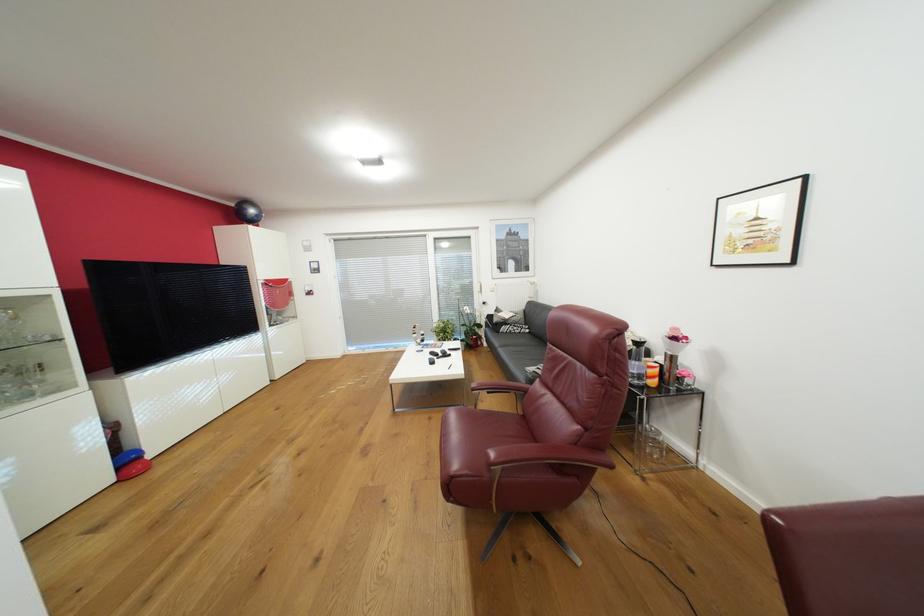
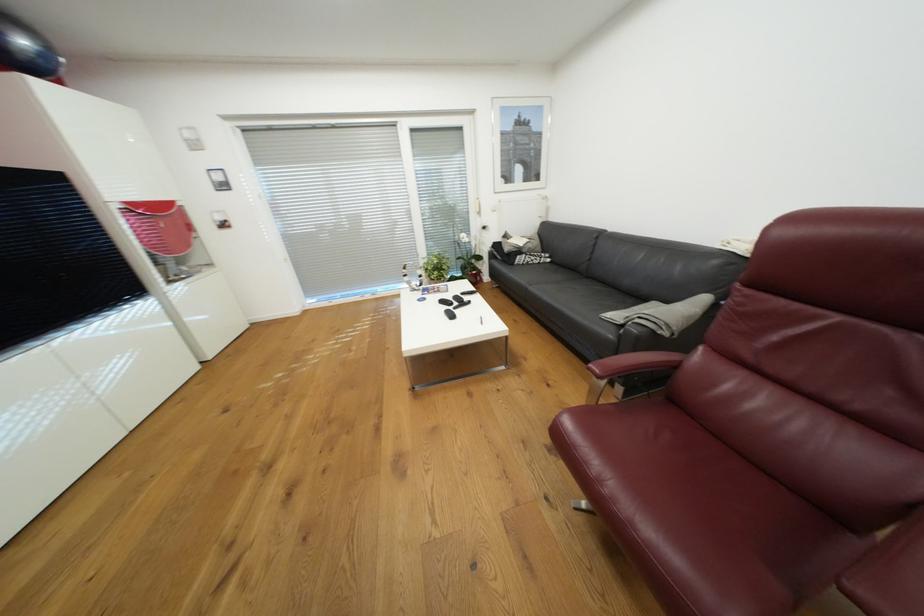
Locate, in the second image, the point that corresponds to [444,351] in the first image.

(456, 297)